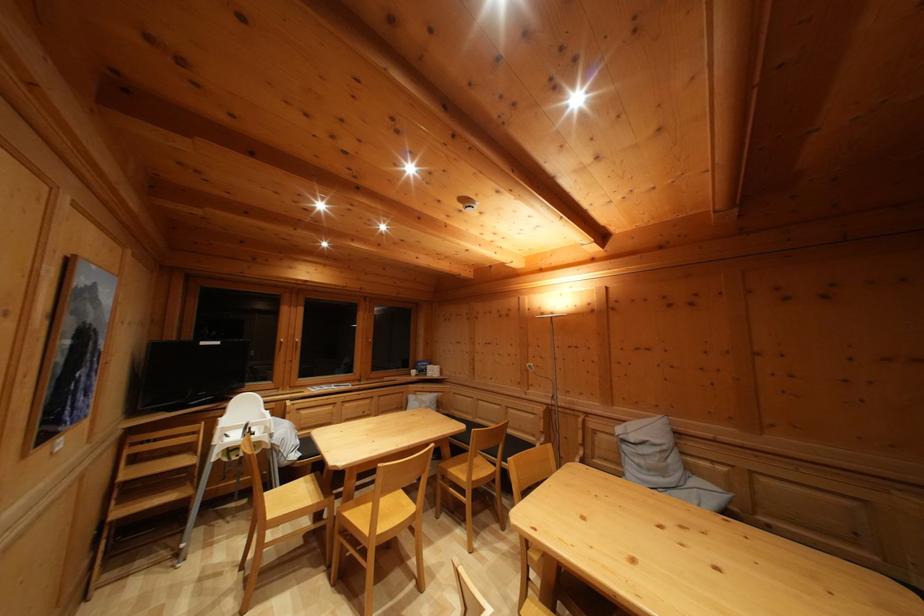
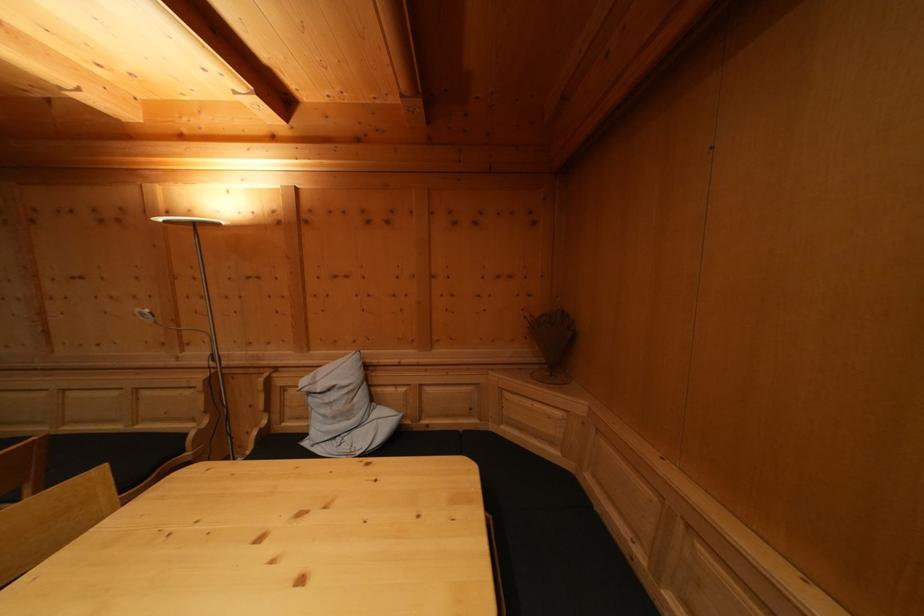
Question: The camera is either moving clockwise (left) or counter-clockwise (right) around the object. The first image is from the beginning of the video and the second image is from the end. Is the camera moving left or right when shooting the video?

Choices:
 (A) Left
 (B) Right

Answer: (A)